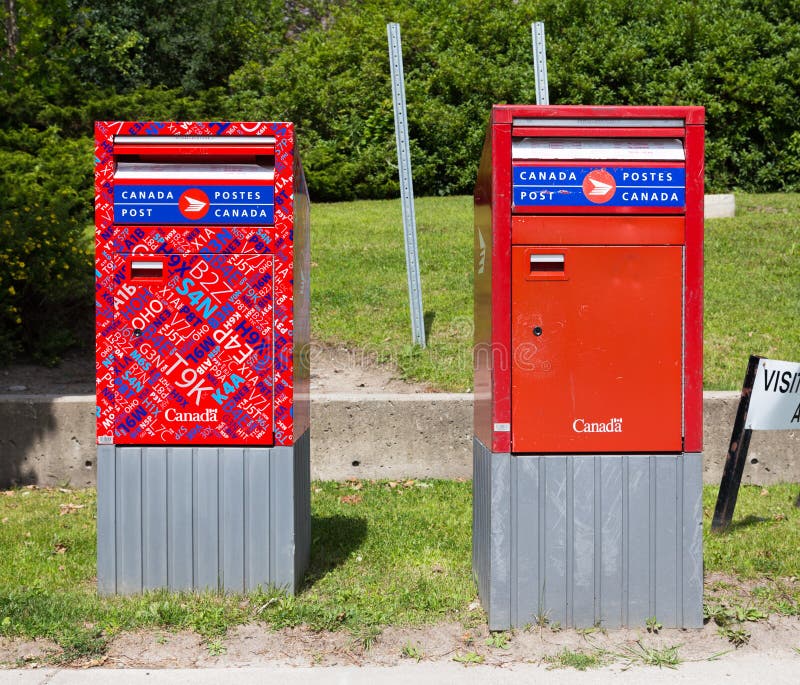
Locate an element on the screen. keyhole is located at coordinates (533, 329), (138, 334).